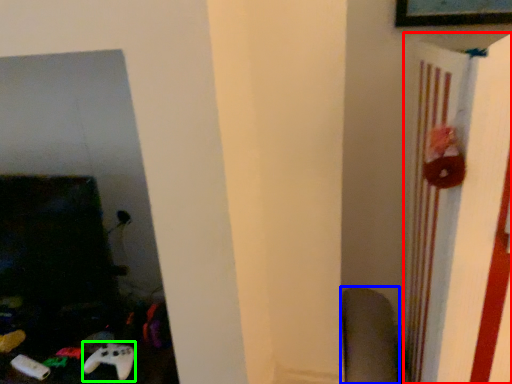
Question: Estimate the real-world distances between objects in this image. Which object is closer to bulletin board (highlighted by a red box), swivel chair (highlighted by a blue box) or game controller (highlighted by a green box)?

Choices:
 (A) swivel chair
 (B) game controller

Answer: (A)